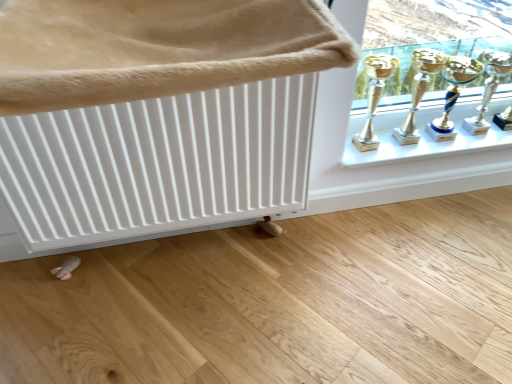
Where is `vacant region to the right of white matte radiator at upper left`? vacant region to the right of white matte radiator at upper left is located at coordinates tap(360, 278).